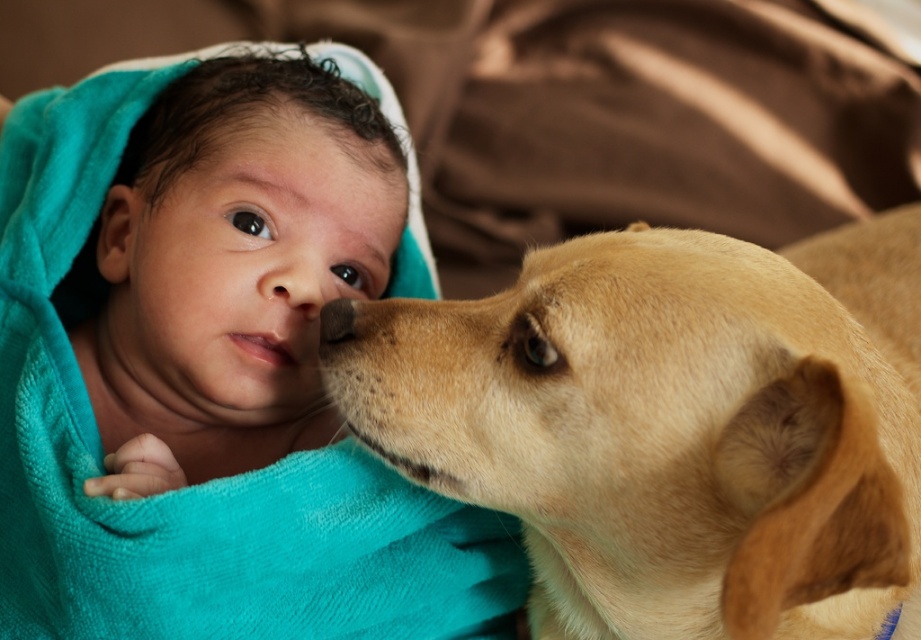
Question: Which point is closer to the camera?

Choices:
 (A) (875, 456)
 (B) (315, 269)

Answer: (A)

Question: Is light brown fur dog at center to the right of smooth beige nose at center from the viewer's perspective?

Choices:
 (A) yes
 (B) no

Answer: (A)

Question: Is the position of light brown fur dog at center less distant than that of smooth beige nose at center?

Choices:
 (A) yes
 (B) no

Answer: (A)

Question: In this image, where is turquoise towel wrapped baby at center located relative to smooth beige nose at center?

Choices:
 (A) below
 (B) above

Answer: (A)

Question: Which is farther from the turquoise towel wrapped baby at center?

Choices:
 (A) light brown fur dog at center
 (B) smooth beige nose at center

Answer: (A)

Question: Based on their relative distances, which object is nearer to the smooth beige nose at center?

Choices:
 (A) light brown fur dog at center
 (B) turquoise towel wrapped baby at center

Answer: (B)